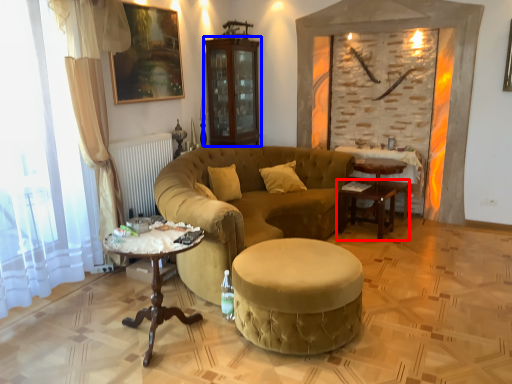
Question: Which of the following is the farthest to the observer, table (highlighted by a red box) or armoire (highlighted by a blue box)?

Choices:
 (A) table
 (B) armoire

Answer: (B)